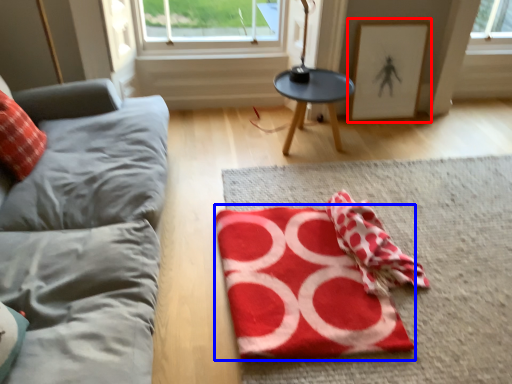
Question: Which object is closer to the camera taking this photo, picture frame (highlighted by a red box) or yoga mat (highlighted by a blue box)?

Choices:
 (A) picture frame
 (B) yoga mat

Answer: (B)